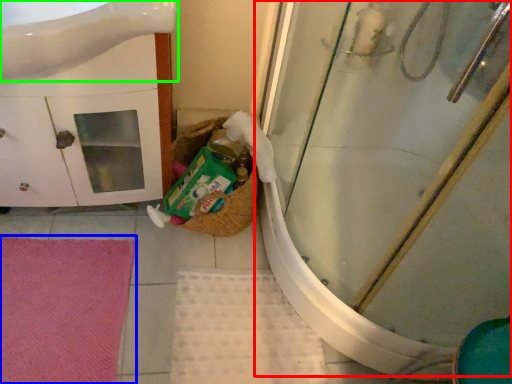
Question: Which object is the closest to the shower door (highlighted by a red box)? Choose among these: bath mat (highlighted by a blue box) or sink (highlighted by a green box).

Choices:
 (A) bath mat
 (B) sink

Answer: (B)